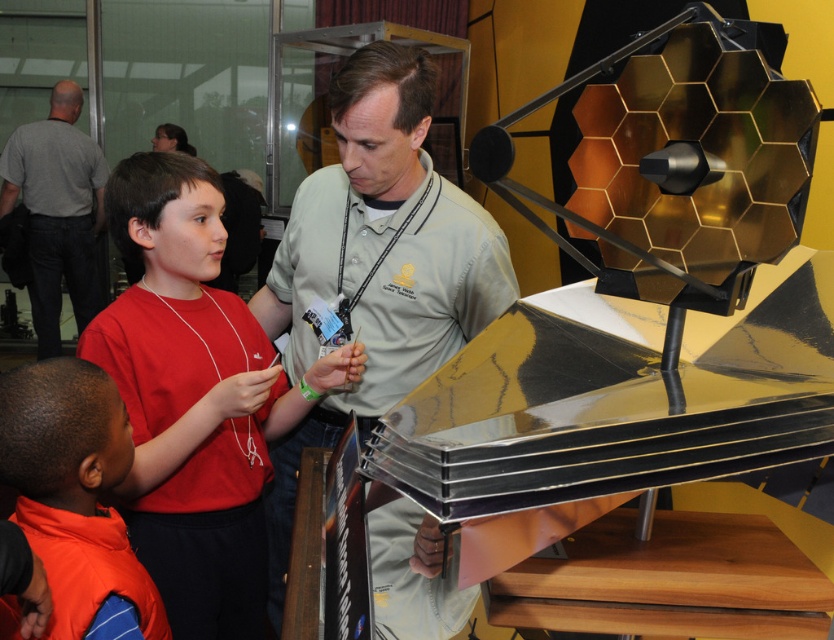
You are a robot with a 1.2 meter arm. You need to retrieve the matte red shirt at center. Can your arm reach it?

The matte red shirt at center is 1.34 meters away from the viewer. Since your arm is only 1.2 meters long, it cannot reach the matte red shirt at center.

You are standing in the room and see two points marked in the image. Which point is closer to you, point (219,193) or point (86,621)?

Point (219,193) is closer to you because it is further to the viewer than point (86,621).

You are a photographer trying to capture a group photo of the green matte shirt at center and the orange fleece vest at lower left. The camera you have can only focus on objects within a 60 cm range. Will both subjects be in focus?

The green matte shirt at center is 67.15 centimeters from the orange fleece vest at lower left. Since the distance between them exceeds the camera focus range of 60 cm, the photographer will not be able to have both subjects in focus simultaneously.